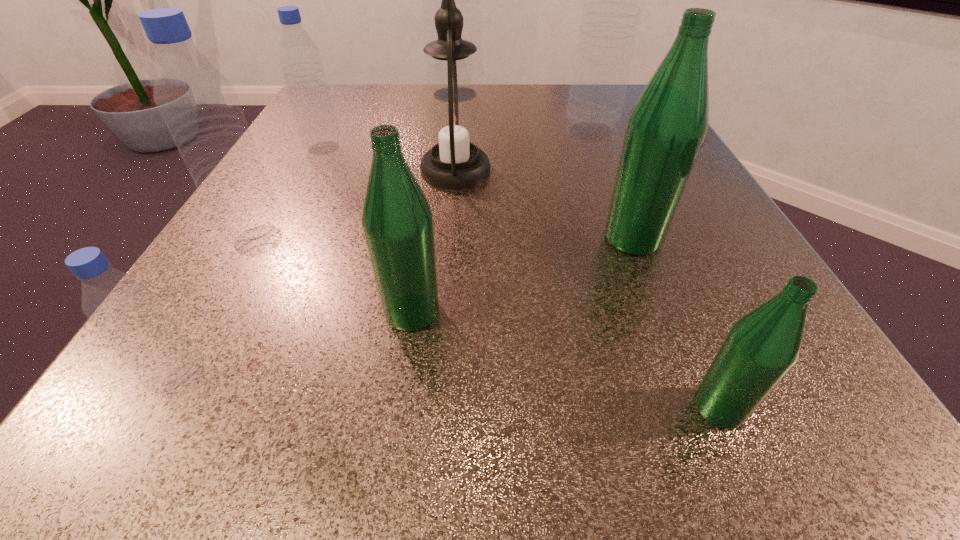
Identify the location of object that is the fourth closest to the nearest green bottle. (124, 310).

Locate an element on the screen. This screenshot has width=960, height=540. the closest bottle to the smallest green bottle is located at coordinates (666, 127).

Where is `bottle that is the seventh closest to the second nearest blue bottle`? bottle that is the seventh closest to the second nearest blue bottle is located at coordinates (762, 346).

What are the coordinates of `blue bottle that is the second closest to the oil lamp` in the screenshot? It's located at (302, 66).

Find the location of a particular element. blue bottle that is the fourth closest to the farthest green bottle is located at coordinates (302, 66).

The width and height of the screenshot is (960, 540). I want to click on the second closest green bottle to the leftmost green bottle, so click(x=762, y=346).

Find the location of `green bottle that stands as the second closest to the leftmost green bottle`. green bottle that stands as the second closest to the leftmost green bottle is located at coordinates (762, 346).

At what (x,y) coordinates should I click in order to perform the action: click on free space in the image that satisfies the following two spatial constraints: 1. on the front side of the second farthest green bottle; 2. on the left side of the nearest green bottle. Please return your answer as a coordinate pair (x, y). This screenshot has height=540, width=960. Looking at the image, I should click on (397, 407).

In order to click on vacant point that satisfies the following two spatial constraints: 1. on the back side of the third smallest blue bottle; 2. on the left side of the second smallest blue bottle in this screenshot , I will do `click(311, 148)`.

At what (x,y) coordinates should I click in order to perform the action: click on free space that satisfies the following two spatial constraints: 1. on the back side of the second nearest green bottle; 2. on the left side of the farthest green bottle. Please return your answer as a coordinate pair (x, y). This screenshot has height=540, width=960. Looking at the image, I should click on [x=422, y=238].